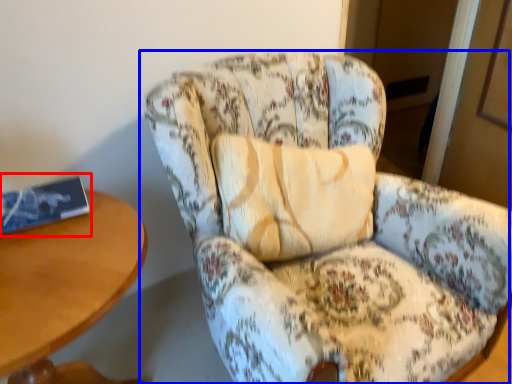
Question: Which object appears closest to the camera in this image, book (highlighted by a red box) or chair (highlighted by a blue box)?

Choices:
 (A) book
 (B) chair

Answer: (B)